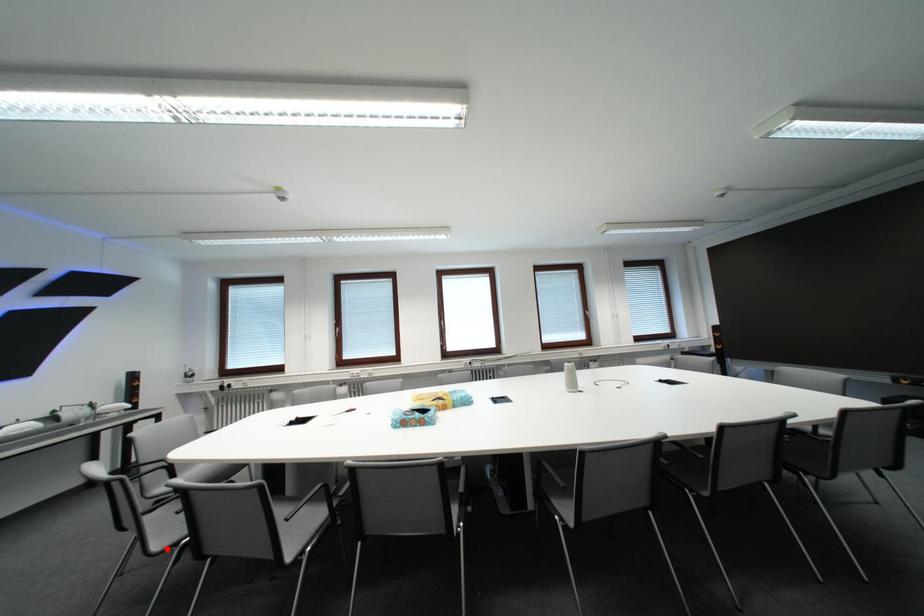
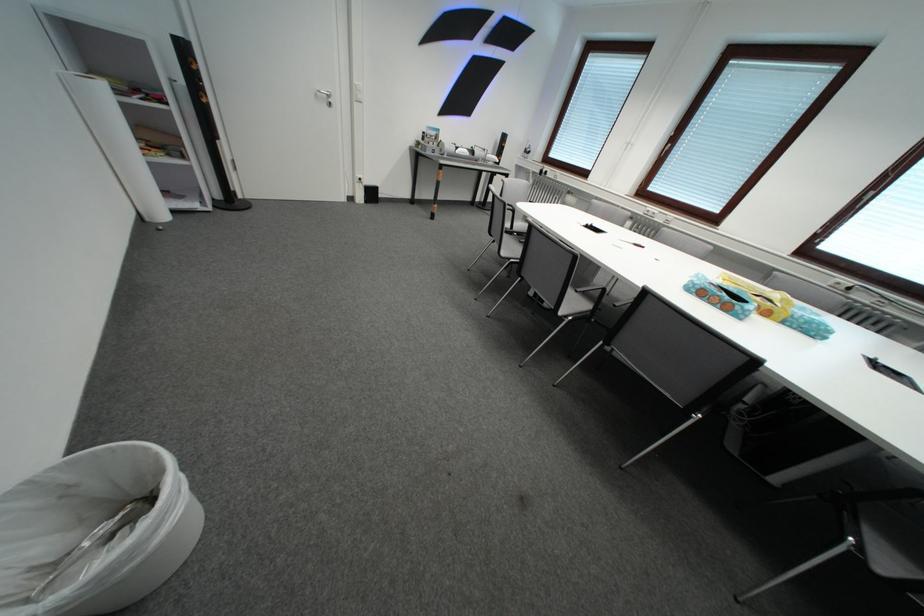
Where in the second image is the point corresponding to the highlighted location from the first image?

(514, 256)